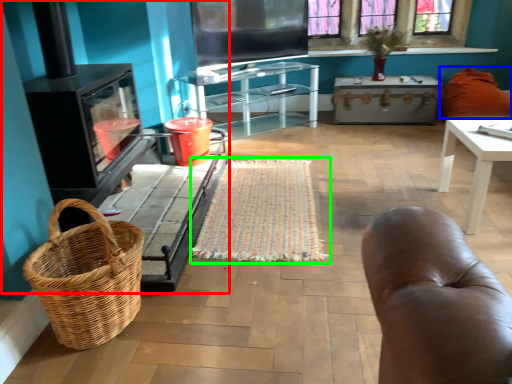
Question: Which is farther away from fireplace (highlighted by a red box)? pillow (highlighted by a blue box) or mat (highlighted by a green box)?

Choices:
 (A) pillow
 (B) mat

Answer: (A)